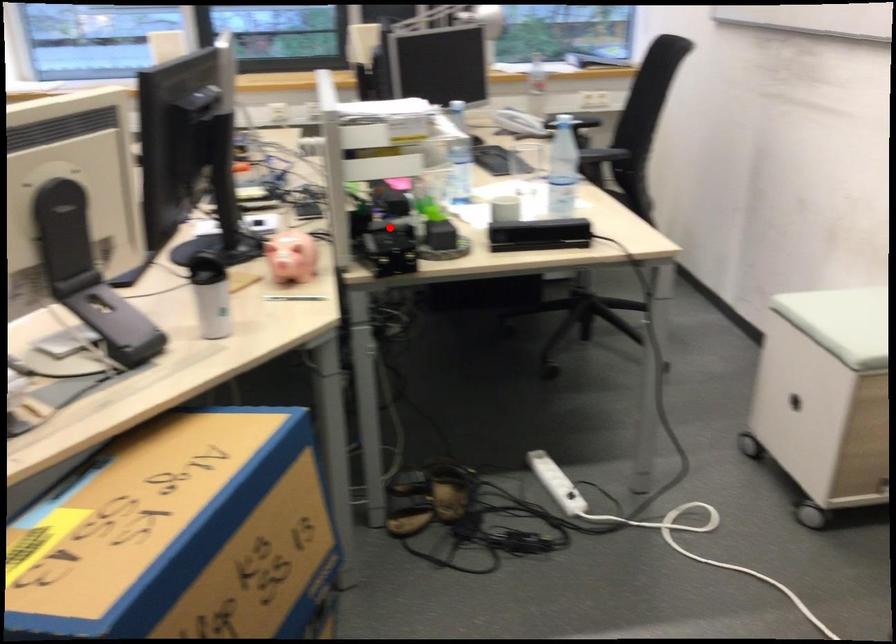
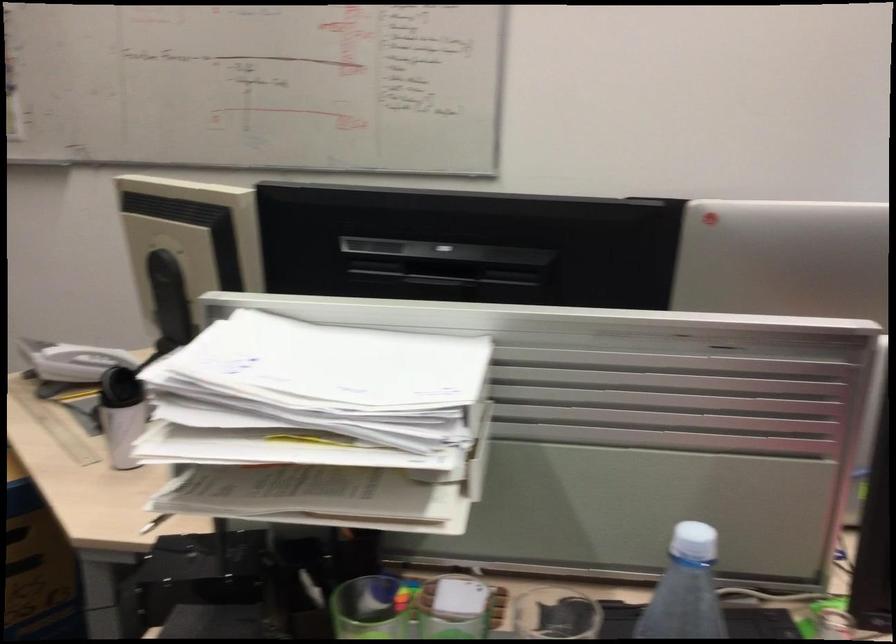
Find the pixel in the second image that matches the highlighted location in the first image.

(367, 609)